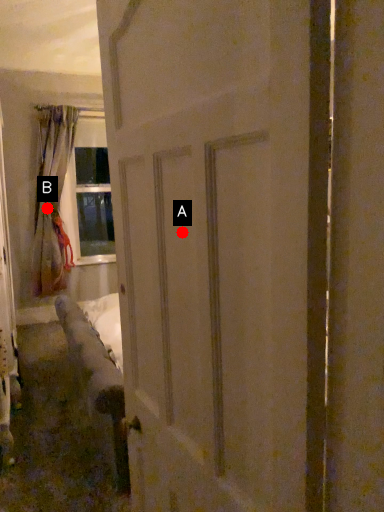
Question: Two points are circled on the image, labeled by A and B beside each circle. Which point is closer to the camera?

Choices:
 (A) A is closer
 (B) B is closer

Answer: (A)